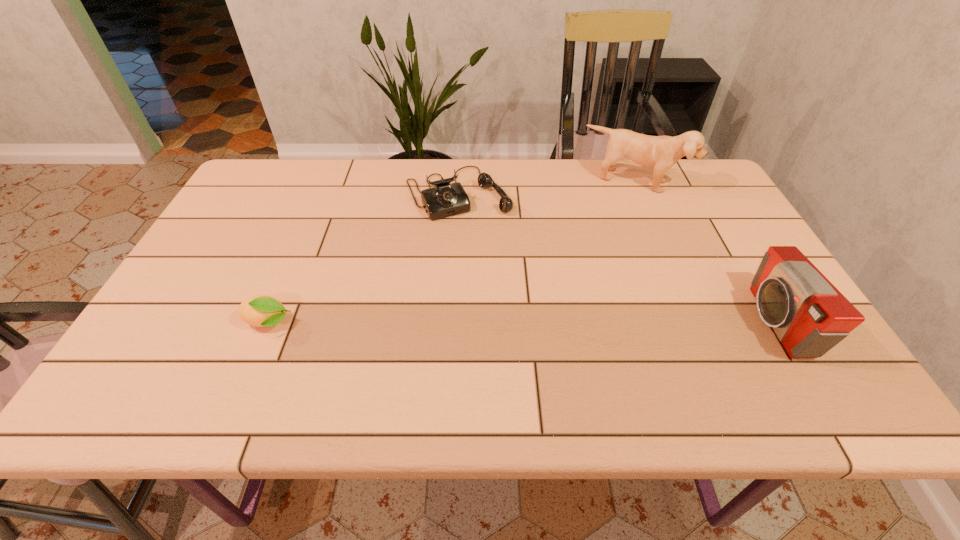
This screenshot has width=960, height=540. Identify the location of empty location between the third tallest object and the camera. (616, 257).

You are a GUI agent. You are given a task and a screenshot of the screen. Output one action in this format:
    pyautogui.click(x=<x>, y=<y>)
    Task: Click on the vacant space that's between the telephone and the shortest object
    This screenshot has width=960, height=540.
    Given the screenshot: What is the action you would take?
    pyautogui.click(x=363, y=258)

Locate an element on the screen. The width and height of the screenshot is (960, 540). blank region between the telephone and the tallest object is located at coordinates (547, 187).

Find the location of `vacant space in between the third object from right to left and the puppy`. vacant space in between the third object from right to left and the puppy is located at coordinates (547, 187).

Where is `free space between the lemon and the tallest object`? The image size is (960, 540). free space between the lemon and the tallest object is located at coordinates (452, 253).

Find the location of a particular element. The image size is (960, 540). vacant space in between the telephone and the puppy is located at coordinates (547, 187).

Where is `vacant area that lies between the camera and the puppy`? The height and width of the screenshot is (540, 960). vacant area that lies between the camera and the puppy is located at coordinates (706, 252).

Locate an element on the screen. The height and width of the screenshot is (540, 960). free point between the shortest object and the puppy is located at coordinates (452, 253).

In order to click on blank region between the second object from left to right and the puppy in this screenshot , I will do [x=547, y=187].

Locate which object is the closest to the camera. Please provide its 2D coordinates. Your answer should be formatted as a tuple, i.e. [(x, y)], where the tuple contains the x and y coordinates of a point satisfying the conditions above.

[(659, 152)]